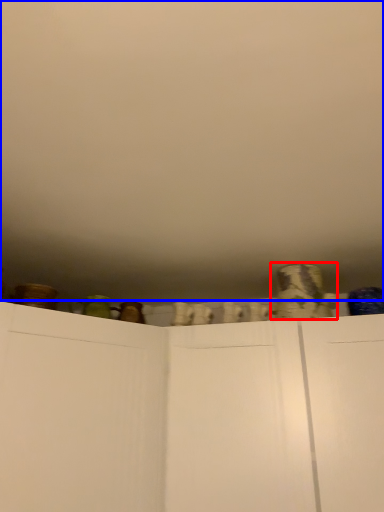
Question: Which point is further to the camera, pottery (highlighted by a red box) or backdrop (highlighted by a blue box)?

Choices:
 (A) pottery
 (B) backdrop

Answer: (A)